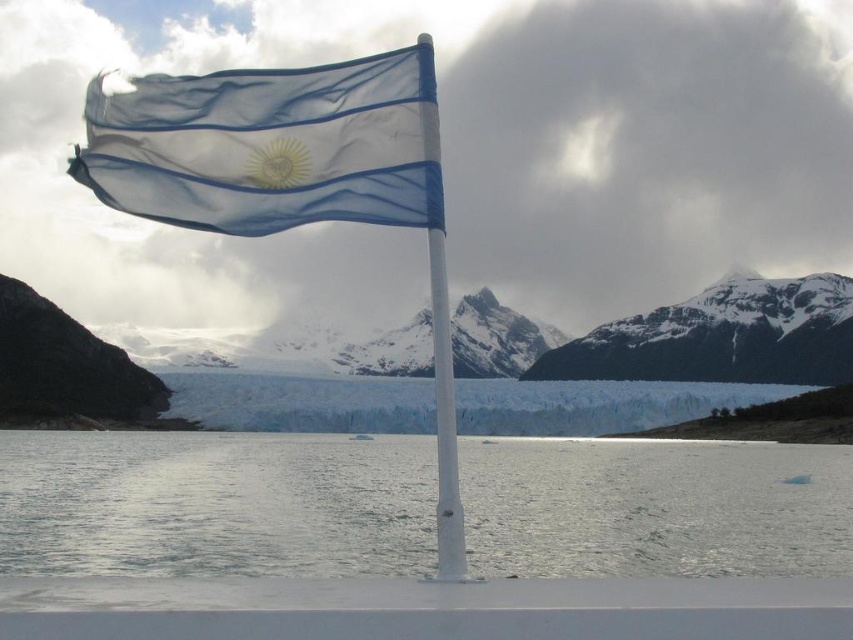
Question: Estimate the real-world distances between objects in this image. Which object is farther from the snowy granite mountain at upper center?

Choices:
 (A) clear water at lower center
 (B) translucent fabric flag at upper center

Answer: (B)

Question: Which point is farther to the camera?

Choices:
 (A) snowy granite mountain at upper center
 (B) translucent fabric flag at upper center
 (C) clear water at lower center

Answer: (A)

Question: Is the position of white plastic flag pole at center more distant than that of translucent fabric flag at upper center?

Choices:
 (A) no
 (B) yes

Answer: (A)

Question: In this image, where is white plastic flag pole at center located relative to snowy granite mountain at center?

Choices:
 (A) left
 (B) right

Answer: (A)

Question: Based on their relative distances, which object is farther from the translucent fabric flag at upper center?

Choices:
 (A) snowy granite mountain at upper center
 (B) clear water at lower center

Answer: (A)

Question: Observing the image, what is the correct spatial positioning of translucent fabric flag at upper center in reference to snowy granite mountain at center?

Choices:
 (A) above
 (B) below

Answer: (A)